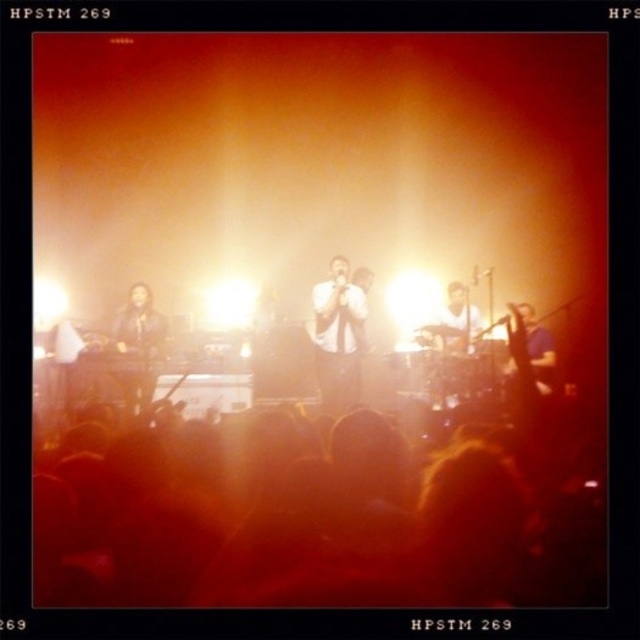
Question: Which point is closer to the camera?

Choices:
 (A) (355, 448)
 (B) (360, 289)
 (C) (540, 321)
 (D) (456, 307)

Answer: (A)

Question: From the image, what is the correct spatial relationship of silhouette crowd at lower center in relation to white matte shirt at center?

Choices:
 (A) below
 (B) above

Answer: (A)

Question: Does silhouette crowd at lower center appear over white matte shirt at center?

Choices:
 (A) no
 (B) yes

Answer: (A)

Question: Estimate the real-world distances between objects in this image. Which object is closer to the white glossy shirt at center?

Choices:
 (A) blue fabric shirt at right
 (B) shiny black jacket at left
 (C) white matte shirt at center

Answer: (C)

Question: Among these points, which one is farthest from the camera?

Choices:
 (A) (349, 356)
 (B) (516, 307)
 (C) (132, 323)

Answer: (C)

Question: Can you confirm if silhouette crowd at lower center is positioned to the right of white matte shirt at center?

Choices:
 (A) no
 (B) yes

Answer: (A)